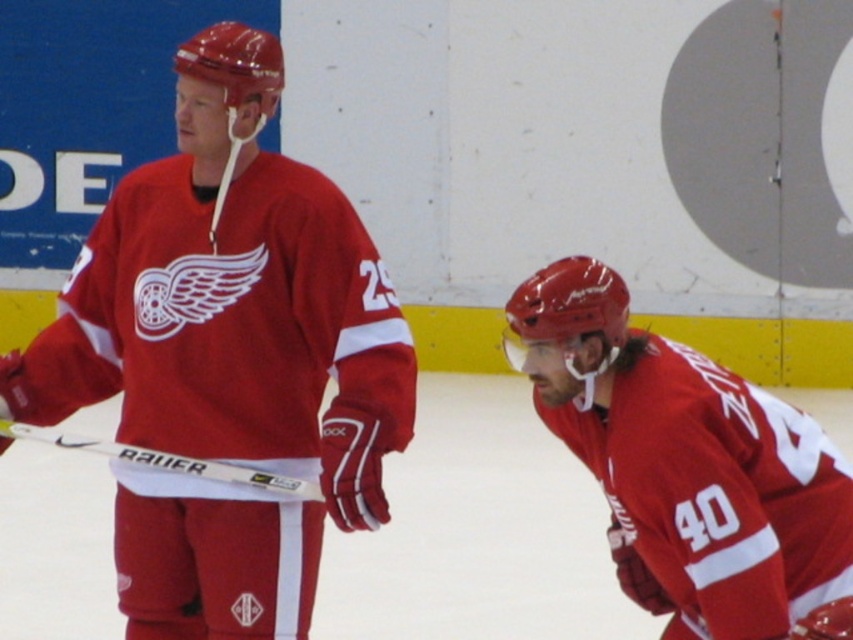
Question: Estimate the real-world distances between objects in this image. Which object is farther from the white matte hockey stick at left?

Choices:
 (A) matte red jersey at lower right
 (B) matte jersey at center

Answer: (A)

Question: Is matte jersey at center below white matte hockey stick at left?

Choices:
 (A) no
 (B) yes

Answer: (A)

Question: Does matte red jersey at lower right have a smaller size compared to white matte hockey stick at left?

Choices:
 (A) no
 (B) yes

Answer: (A)

Question: Estimate the real-world distances between objects in this image. Which object is closer to the matte red jersey at lower right?

Choices:
 (A) matte jersey at center
 (B) white matte hockey stick at left

Answer: (A)

Question: Which point appears farthest from the camera in this image?

Choices:
 (A) (x=155, y=456)
 (B) (x=190, y=541)

Answer: (B)

Question: Observing the image, what is the correct spatial positioning of matte jersey at center in reference to matte red jersey at lower right?

Choices:
 (A) left
 (B) right

Answer: (A)